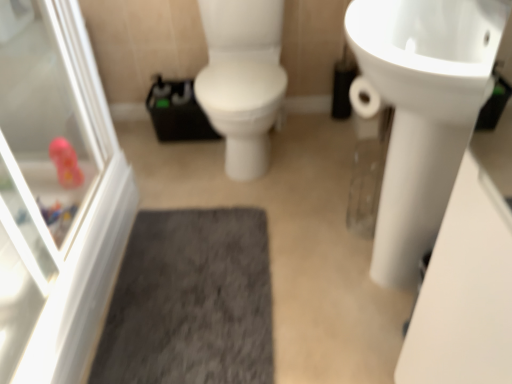
Question: Is white glossy screen door at left wider or thinner than white glossy sink at upper right?

Choices:
 (A) thin
 (B) wide

Answer: (A)

Question: Considering the relative positions of white glossy screen door at left and white glossy sink at upper right in the image provided, is white glossy screen door at left to the left or to the right of white glossy sink at upper right?

Choices:
 (A) left
 (B) right

Answer: (A)

Question: Based on their relative distances, which object is farther from the gray shaggy bath mat at center?

Choices:
 (A) white glossy screen door at left
 (B) white glossy sink at upper right

Answer: (B)

Question: Which object is the closest to the gray shaggy bath mat at center?

Choices:
 (A) white glossy sink at upper right
 (B) white glossy screen door at left

Answer: (B)